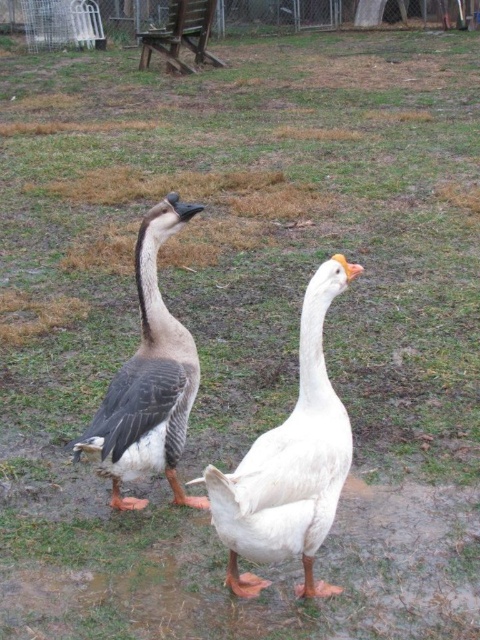
Is the position of white matte goose at center less distant than that of gray-feathered goose at center?

Yes, white matte goose at center is in front of gray-feathered goose at center.

Can you confirm if white matte goose at center is positioned above gray-feathered goose at center?

Actually, white matte goose at center is below gray-feathered goose at center.

Is point (269, 518) behind point (121, 371)?

No.

The height and width of the screenshot is (640, 480). I want to click on white matte goose at center, so click(289, 461).